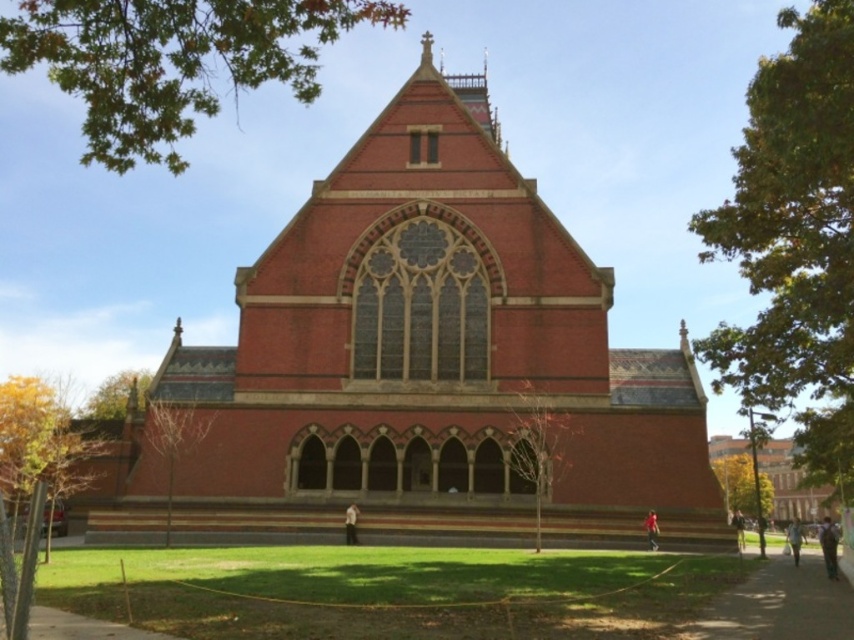
Consider the image. You are standing on the lawn in front of the building. You want to walk towards the green leafy tree at right but need to avoid the matte brick church at lower right. Which direction should you move to reach the tree without going near the church?

The matte brick church at lower right is positioned over the green leafy tree at right, so to reach the tree without going near the church, you should move to the right side of the church, away from its shadow or obstruction.

You are a landscape architect designing a new pathway between the matte brick church at lower right and the green leafy tree at right. What is the minimum width the pathway should be to ensure there is enough space between them?

The matte brick church at lower right and the green leafy tree at right are 6.91 feet apart, so the pathway should be at least 6.91 feet wide to accommodate the space between them.